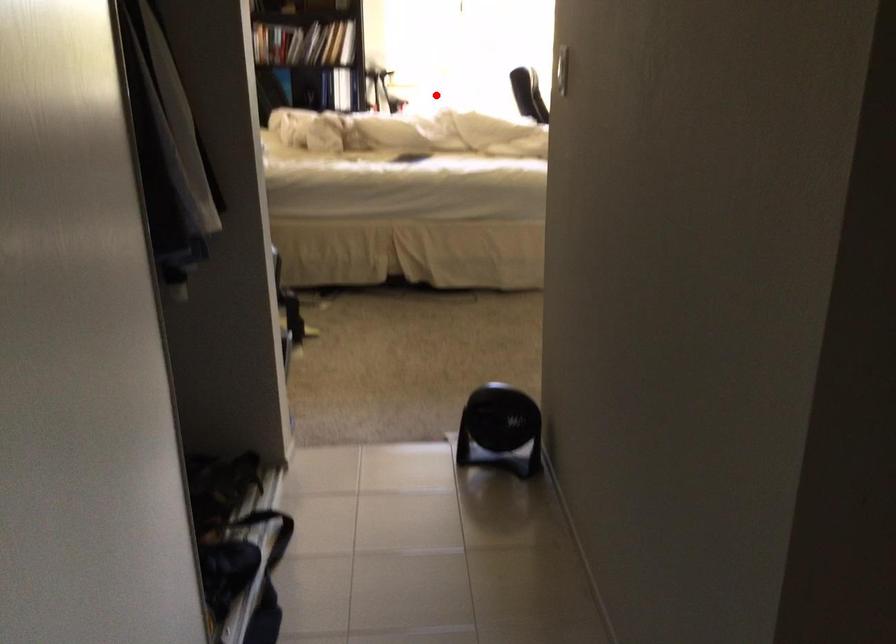
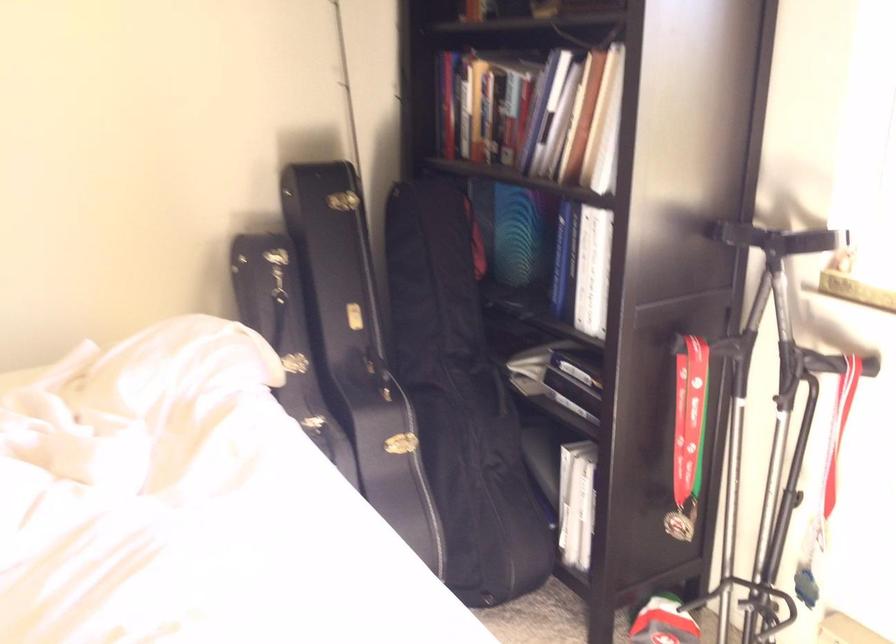
In the second image, find the point that corresponds to the highlighted location in the first image.

(839, 429)